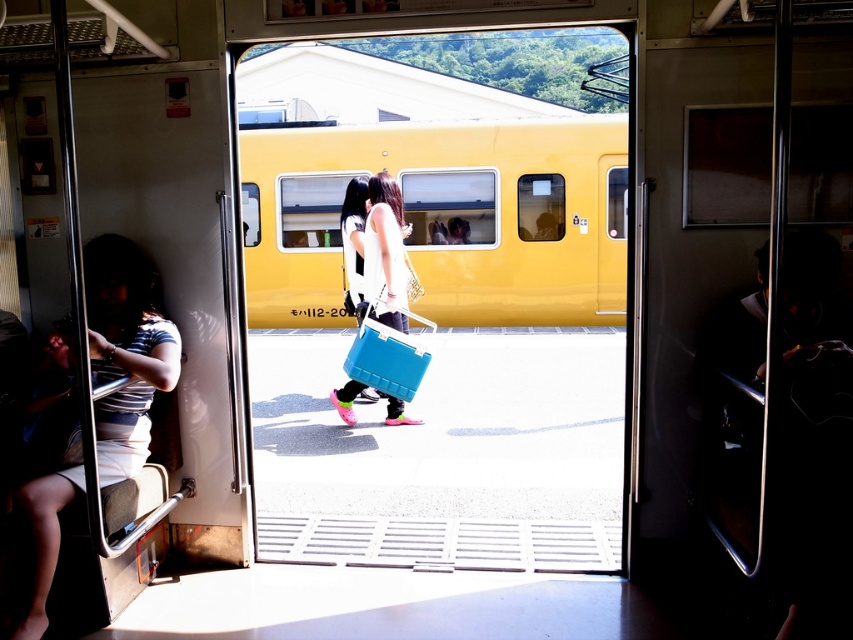
Question: In this image, where is yellow matte train at center located relative to matte white shirt at center?

Choices:
 (A) below
 (B) above

Answer: (B)

Question: Which of these objects is positioned closest to the striped fabric shirt at left?

Choices:
 (A) yellow matte train at center
 (B) matte white shirt at center

Answer: (B)

Question: Among these objects, which one is farthest from the camera?

Choices:
 (A) striped fabric shirt at left
 (B) yellow matte train at center

Answer: (B)

Question: Does yellow matte train at center appear on the left side of matte white shirt at center?

Choices:
 (A) no
 (B) yes

Answer: (A)

Question: Is yellow matte train at center positioned in front of striped fabric shirt at left?

Choices:
 (A) yes
 (B) no

Answer: (B)

Question: Which point appears farthest from the camera in this image?

Choices:
 (A) click(x=318, y=157)
 (B) click(x=149, y=364)

Answer: (A)